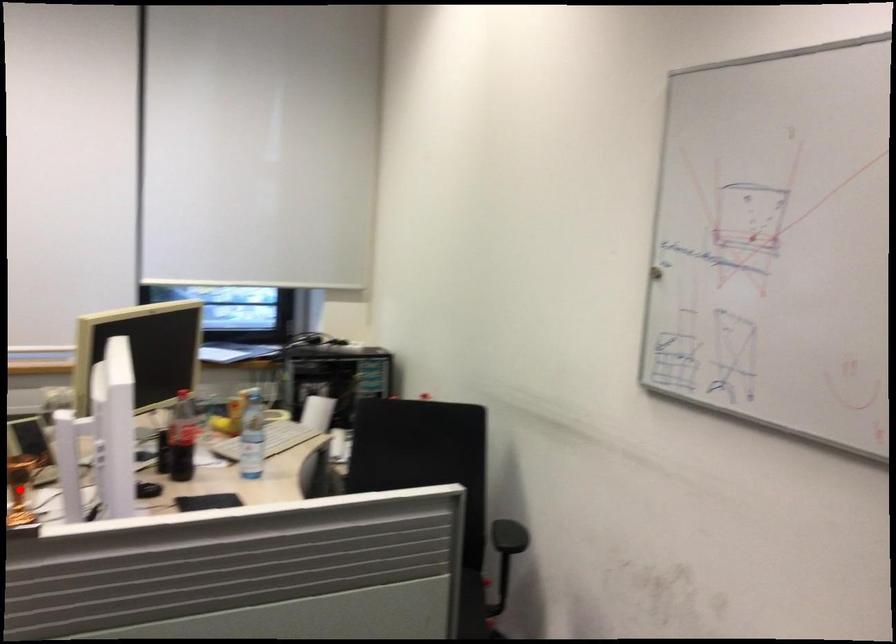
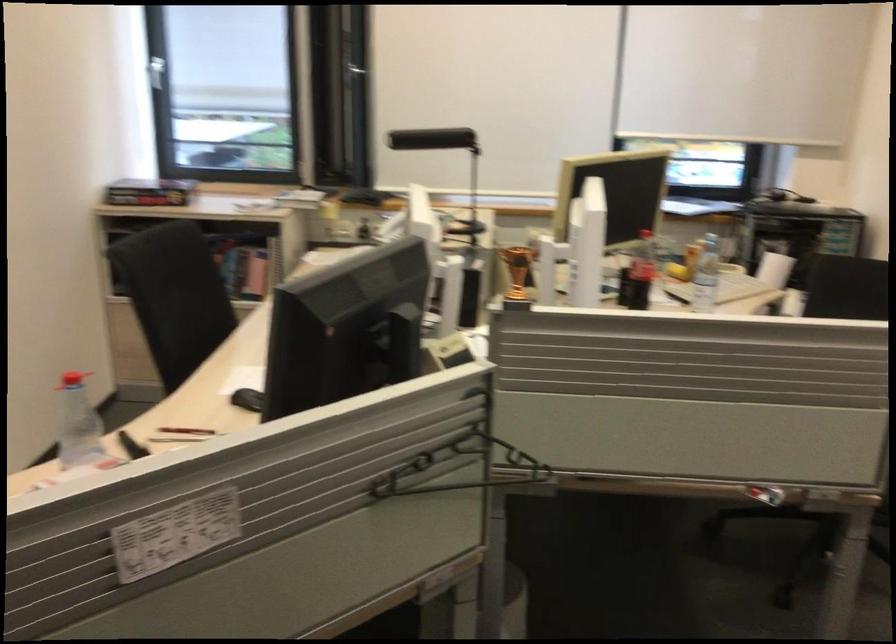
In the second image, find the point that corresponds to the highlighted location in the first image.

(513, 299)